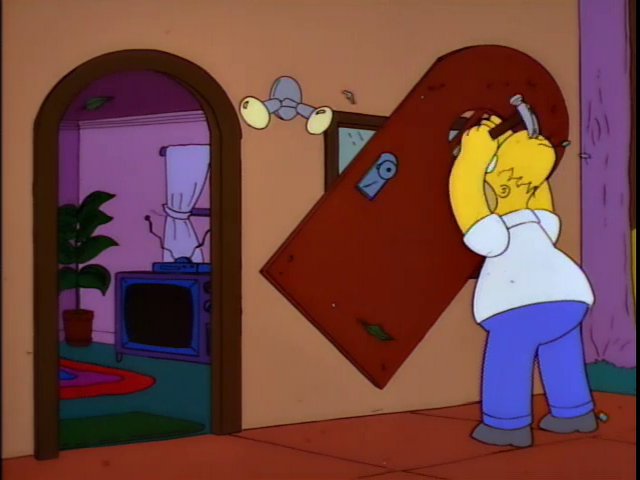
Identify the location of window. The width and height of the screenshot is (640, 480). (353, 143).